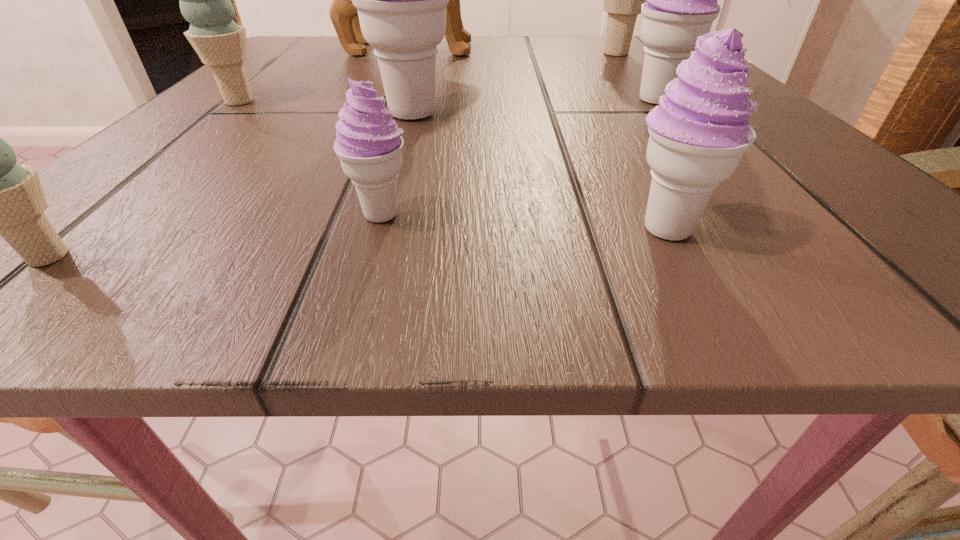
Locate an element on the screen. The height and width of the screenshot is (540, 960). the tallest object is located at coordinates (344, 15).

The width and height of the screenshot is (960, 540). In order to click on the second tallest object in this screenshot , I will do (x=401, y=0).

The height and width of the screenshot is (540, 960). I want to click on the biggest purple icecream, so click(401, 0).

Where is `the biggest blue ice cream`? The height and width of the screenshot is (540, 960). the biggest blue ice cream is located at coordinates (622, 0).

Locate an element on the screen. the rightmost blue ice cream is located at coordinates (622, 0).

At what (x,y) coordinates should I click in order to perform the action: click on the rightmost purple icecream. Please return your answer as a coordinate pair (x, y). The width and height of the screenshot is (960, 540). Looking at the image, I should click on (681, 4).

Locate an element on the screen. This screenshot has height=540, width=960. the second smallest blue ice cream is located at coordinates (204, 0).

Identify the location of the second smallest purple icecream. The width and height of the screenshot is (960, 540). (699, 132).

The height and width of the screenshot is (540, 960). Find the location of `the fifth ice cream from left to right`. the fifth ice cream from left to right is located at coordinates (699, 132).

The image size is (960, 540). I want to click on the smallest purple icecream, so click(x=369, y=144).